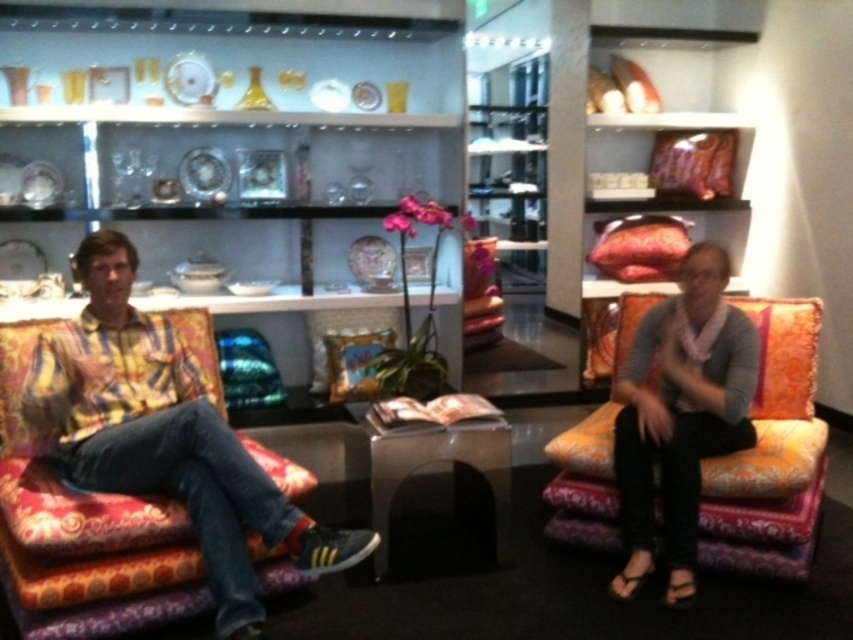
You are a delivery person who needs to move a large rectangular package that is 1.2 meters wide. You see the orange patterned fabric couch at center and the black glossy side table at center in the room. Can the package fit between these two items?

The orange patterned fabric couch at center might be wider than the black glossy side table at center, so the package may or may not fit depending on the exact width of the couch. You should measure the space between them before attempting to move the package.